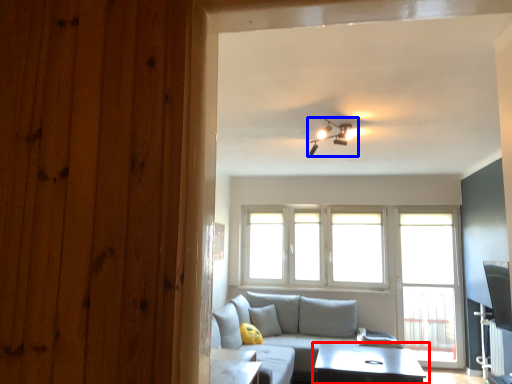
Question: Which point is closer to the camera, table (highlighted by a red box) or light fixture (highlighted by a blue box)?

Choices:
 (A) table
 (B) light fixture

Answer: (B)